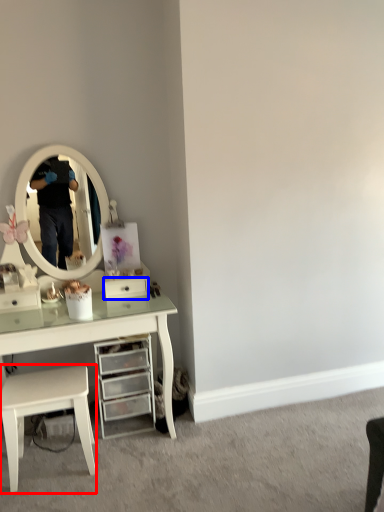
Question: Among these objects, which one is nearest to the camera, stool (highlighted by a red box) or drawer (highlighted by a blue box)?

Choices:
 (A) stool
 (B) drawer

Answer: (A)